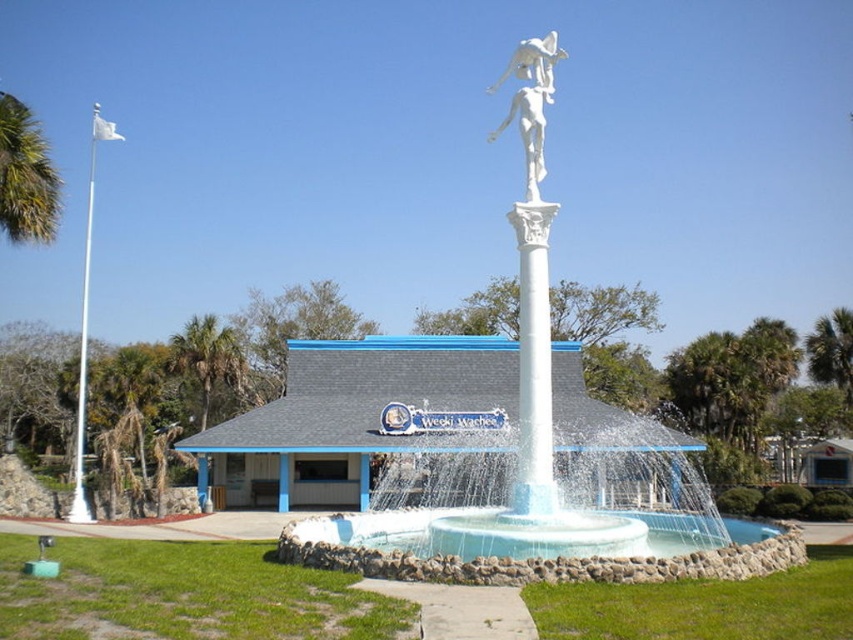
Question: Which point is farther to the camera?

Choices:
 (A) (824, 323)
 (B) (48, 232)
 (C) (553, 348)
 (D) (93, 173)

Answer: (D)

Question: Based on their relative distances, which object is farther from the green leafy palm tree at left?

Choices:
 (A) white marble statue at center
 (B) green leafy palm tree at upper left
 (C) white marble statue at upper center

Answer: (B)

Question: Considering the relative positions of white marble statue at center and white metallic flagpole at left in the image provided, where is white marble statue at center located with respect to white metallic flagpole at left?

Choices:
 (A) left
 (B) right

Answer: (B)

Question: Which object is closer to the camera taking this photo?

Choices:
 (A) green leafy palm tree at upper left
 (B) white marble statue at upper center

Answer: (B)

Question: Does green leafy palm tree at left appear on the right side of white metallic flagpole at left?

Choices:
 (A) yes
 (B) no

Answer: (A)

Question: Observing the image, what is the correct spatial positioning of green leafy palm tree at left in reference to green leafy palm tree at upper right?

Choices:
 (A) right
 (B) left

Answer: (B)